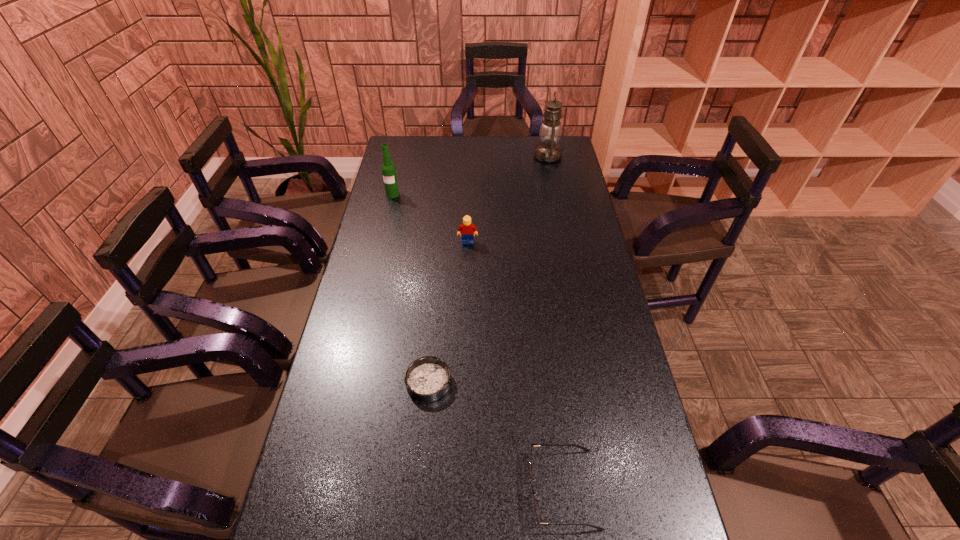
Locate an element on the screen. vacant space located on the back of the oil lamp is located at coordinates (545, 140).

Identify the location of vacant space situated 0.050m on the label of the fourth shortest object. (390, 206).

Where is `vacant region located on the front-facing side of the third tallest object`? This screenshot has width=960, height=540. vacant region located on the front-facing side of the third tallest object is located at coordinates (466, 307).

Locate an element on the screen. vacant space located 0.070m on the front-facing side of the nearest object is located at coordinates (498, 489).

This screenshot has width=960, height=540. I want to click on free location located 0.250m on the front-facing side of the nearest object, so click(420, 489).

Where is `vacant space located on the front-facing side of the nearest object`? The height and width of the screenshot is (540, 960). vacant space located on the front-facing side of the nearest object is located at coordinates (438, 489).

Where is `vacant space located 0.120m on the right of the ashtray`? This screenshot has height=540, width=960. vacant space located 0.120m on the right of the ashtray is located at coordinates (495, 382).

This screenshot has height=540, width=960. Find the location of `object located at the far edge`. object located at the far edge is located at coordinates (548, 150).

At what (x,y) coordinates should I click in order to perform the action: click on object situated at the left edge. Please return your answer as a coordinate pair (x, y). Image resolution: width=960 pixels, height=540 pixels. Looking at the image, I should click on (388, 169).

Identify the location of oil lamp present at the right edge. The width and height of the screenshot is (960, 540). (548, 150).